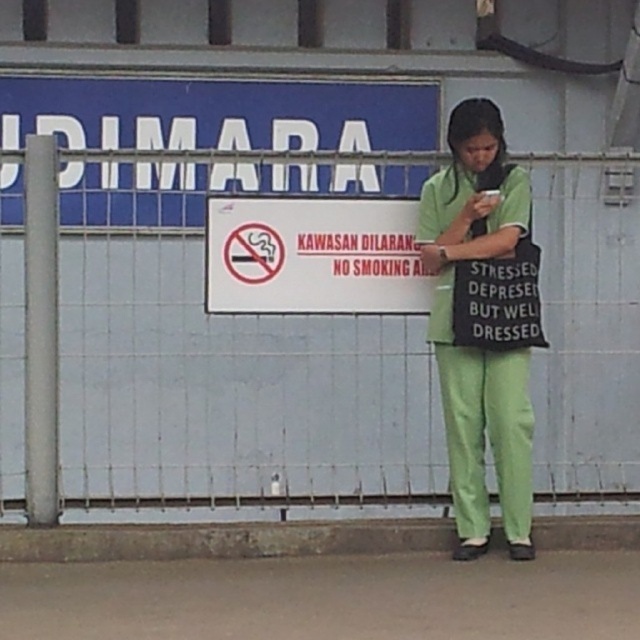
Which is in front, point (195, 252) or point (502, 132)?

Point (502, 132)

The height and width of the screenshot is (640, 640). I want to click on metal wire fence at center, so click(x=212, y=346).

Which is more to the left, metal wire fence at center or white paper sign at center?

metal wire fence at center is more to the left.

Which is in front, point (353, 234) or point (406, 268)?

Positioned in front is point (406, 268).

Does point (209, 464) come in front of point (413, 227)?

No, it is behind (413, 227).

Where is `metal wire fence at center`? metal wire fence at center is located at coordinates (212, 346).

Does green fabric bag at center have a greater height compared to white paper sign at center?

Correct, green fabric bag at center is much taller as white paper sign at center.

Does green fabric bag at center have a greater width compared to white paper sign at center?

No.

Does point (518, 536) lie behind point (243, 221)?

No.

Find the location of `green fabric bag at center`. green fabric bag at center is located at coordinates (477, 349).